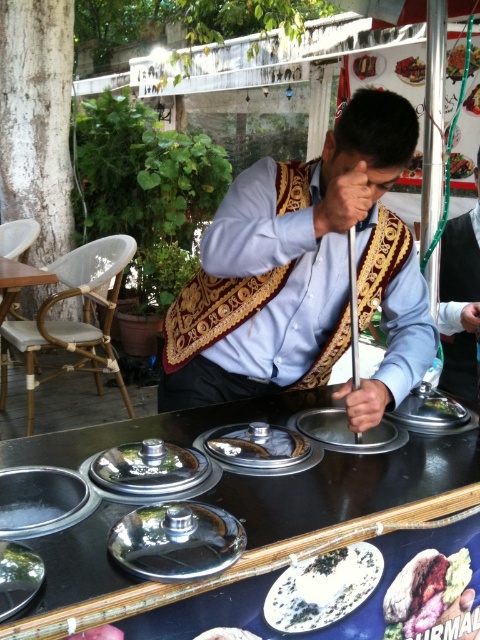
You are a customer at the food stall. You see the shiny metallic lid at center and the brown matte bread at center on the counter. Which item has a larger diameter?

The shiny metallic lid at center might be wider than brown matte bread at center, so it likely has a larger diameter.

You are a customer standing in front of the food vendor. You want to know where the matte gold vest at center is located relative to your position. Can you describe its position using coordinates?

The matte gold vest at center is located at coordinates point (460, 300).